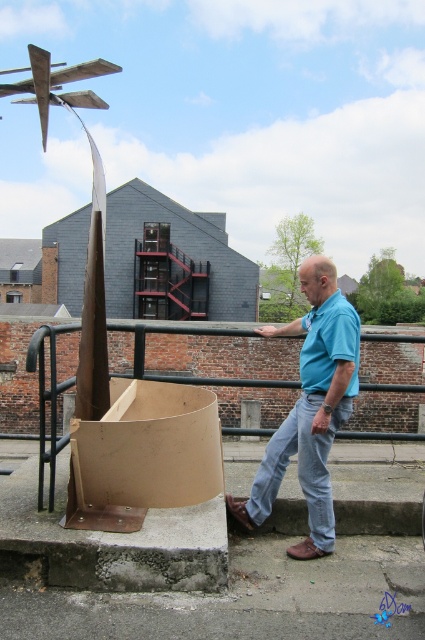
You are a photographer trying to capture the blue cotton shirt at center and the brown metal rail at center in the same frame. Which object will appear narrower in the photo?

The blue cotton shirt at center will appear narrower in the photo because it has a lesser width compared to the brown metal rail at center.

You are a delivery drone with a wingspan of 1.2 meters. You need to fly between the brown metal rail at center and the light blue denim jeans at lower center. Can you safely navigate this space without touching either object?

The distance between the brown metal rail at center and the light blue denim jeans at lower center is 8.41 meters. Since your wingspan is only 1.2 meters, you have more than enough space to safely navigate between them without touching either object.

You are a fashion designer analyzing the outfit of the man in the image. Based on the scene description, which clothing item is longer in length between the blue cotton shirt at center and the light blue denim jeans at lower center?

The blue cotton shirt at center is much taller than the light blue denim jeans at lower center, so the blue cotton shirt at center is longer in length.